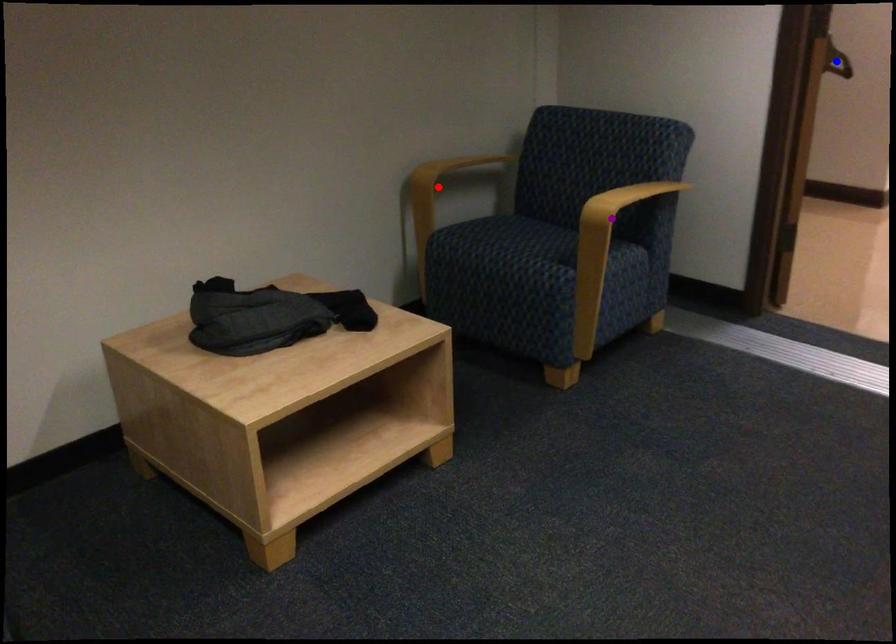
Based on the photo, order these from farthest to nearest:
red point, purple point, blue point

blue point < red point < purple point